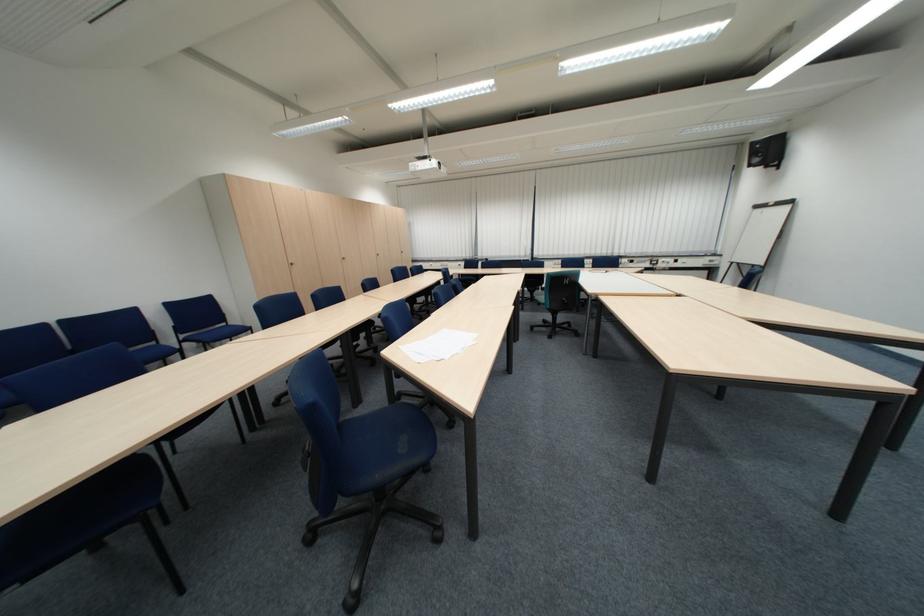
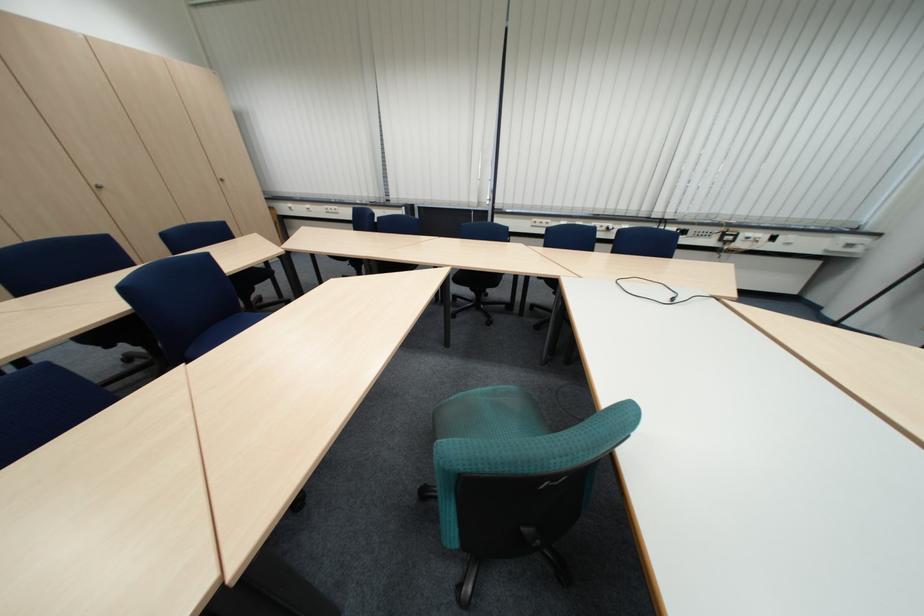
The images are taken continuously from a first-person perspective. In which direction are you moving?

The cameraman moved toward right, forward.